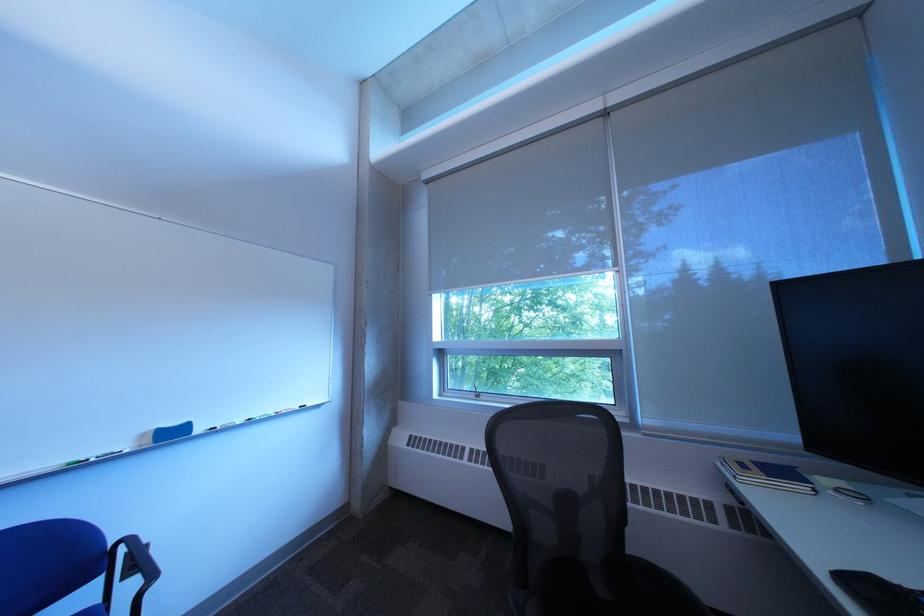
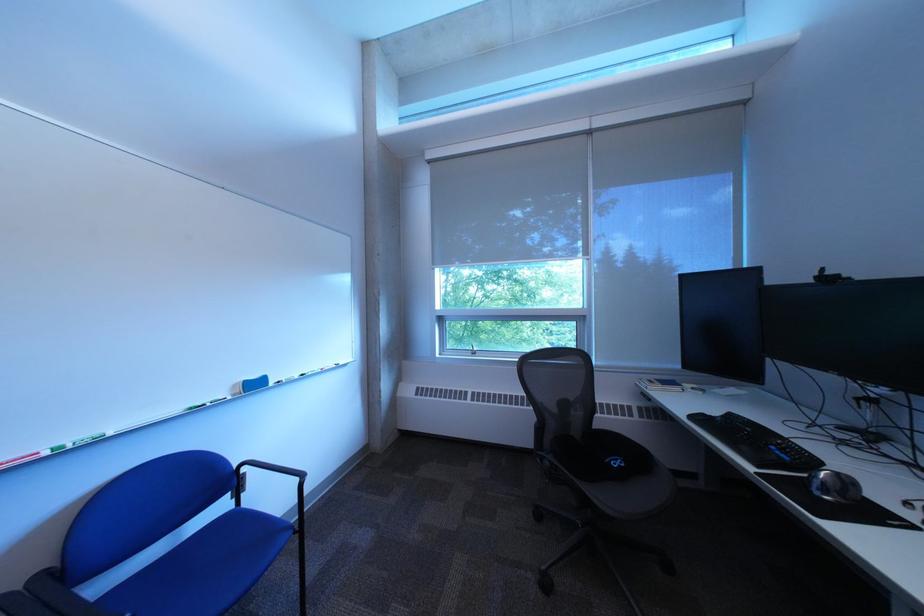
In the second image, find the point that corresponds to the point at 733,468 in the first image.

(651, 386)